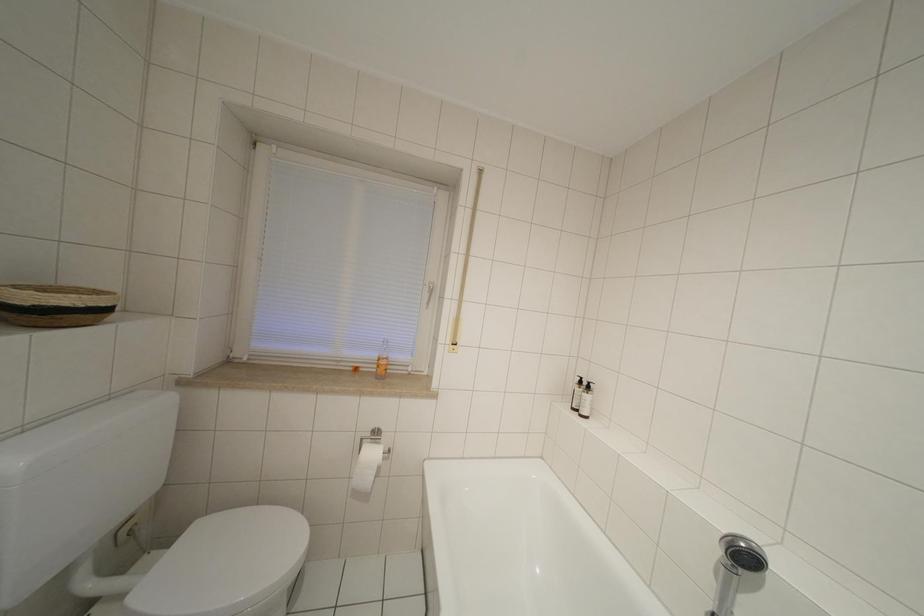
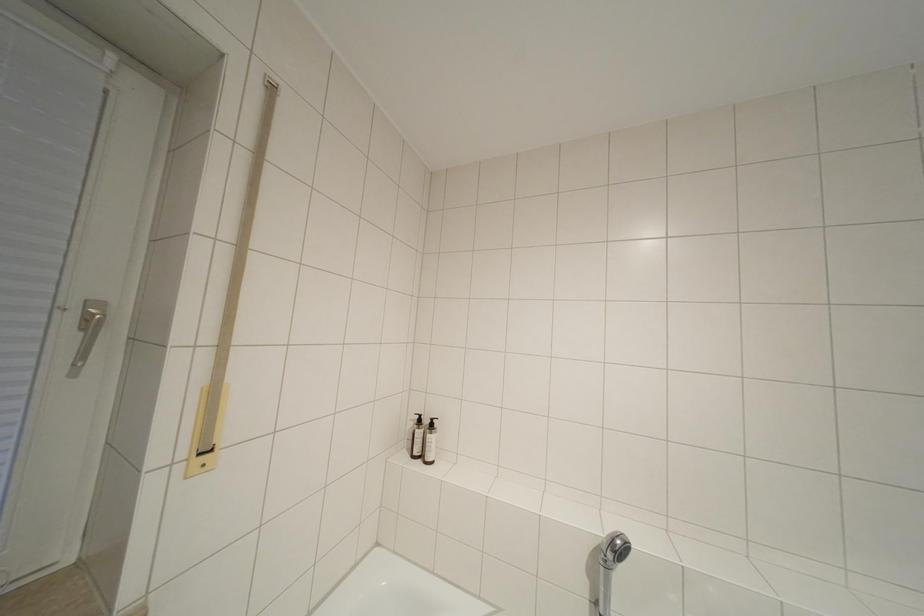
Question: How did the camera likely rotate?

Choices:
 (A) Left
 (B) Right
 (C) Up
 (D) Down

Answer: (B)